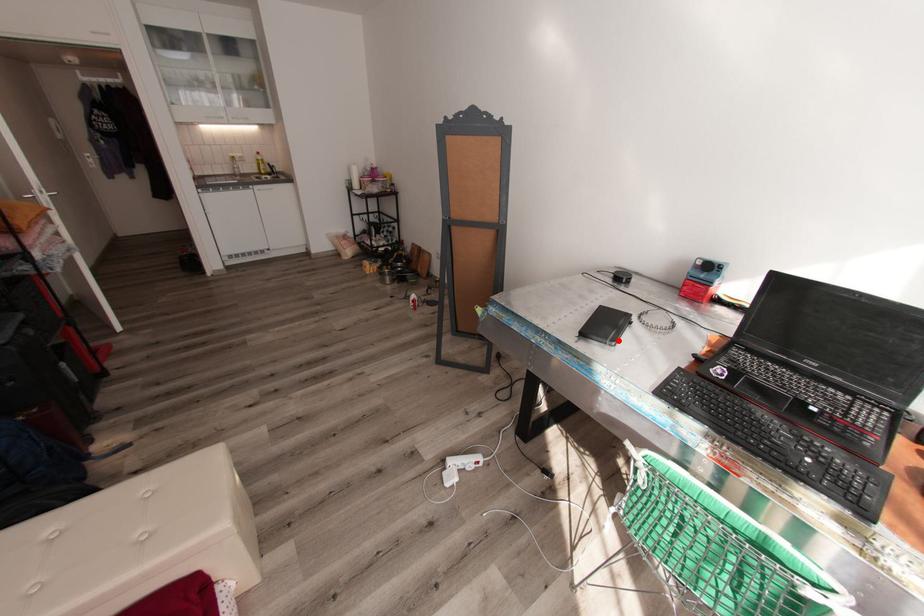
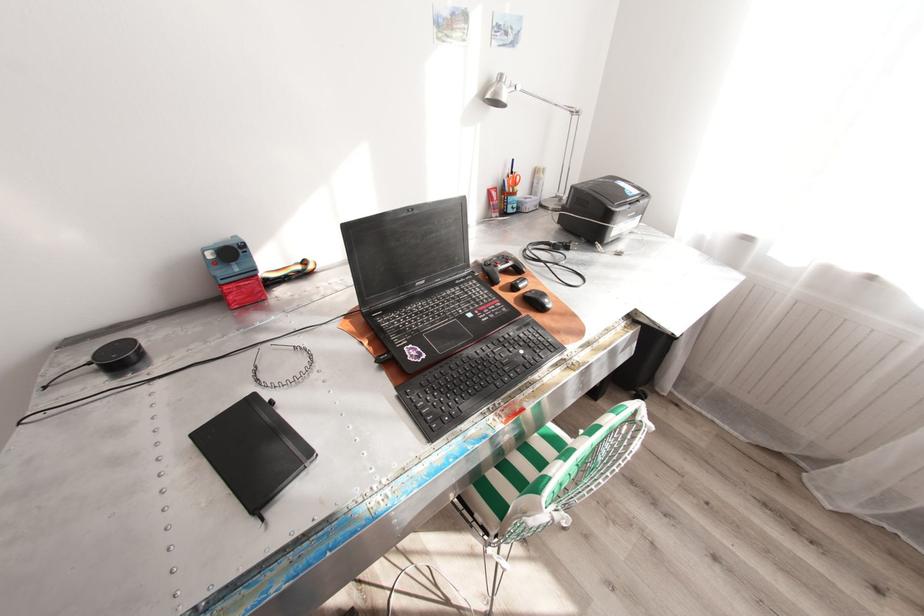
In the second image, find the point that corresponds to the highlighted location in the first image.

(314, 452)